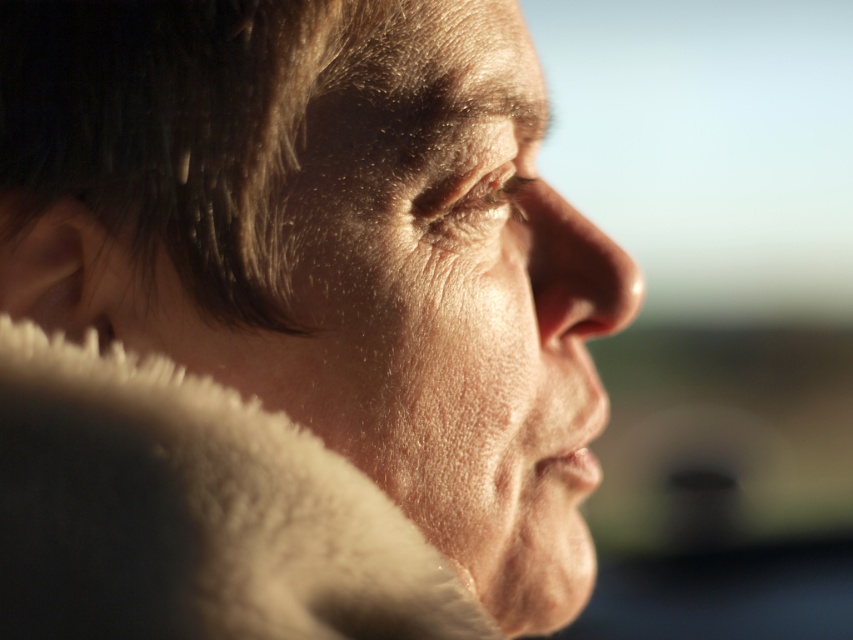
Between white fluffy fur coat at lower left and smooth skin nose at center, which one is positioned higher?

Positioned higher is smooth skin nose at center.

Who is positioned more to the left, white fluffy fur coat at lower left or smooth skin nose at center?

white fluffy fur coat at lower left is more to the left.

The width and height of the screenshot is (853, 640). What do you see at coordinates (192, 513) in the screenshot?
I see `white fluffy fur coat at lower left` at bounding box center [192, 513].

The height and width of the screenshot is (640, 853). What are the coordinates of `white fluffy fur coat at lower left` in the screenshot? It's located at (192, 513).